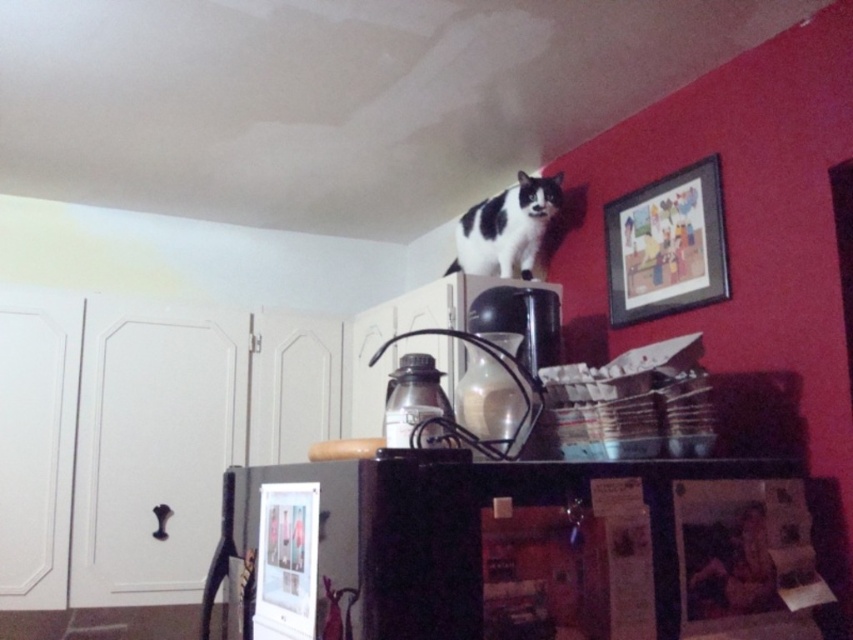
Question: Can you confirm if wooden framed artwork at upper right is thinner than black and white fur cat at upper center?

Choices:
 (A) no
 (B) yes

Answer: (B)

Question: Considering the relative positions of wooden framed artwork at upper right and black and white fur cat at upper center in the image provided, where is wooden framed artwork at upper right located with respect to black and white fur cat at upper center?

Choices:
 (A) above
 (B) below

Answer: (B)

Question: Which point appears closest to the camera in this image?

Choices:
 (A) (653, 259)
 (B) (529, 278)

Answer: (A)

Question: Can you confirm if wooden framed artwork at upper right is bigger than black and white fur cat at upper center?

Choices:
 (A) yes
 (B) no

Answer: (B)

Question: Which point appears closest to the camera in this image?

Choices:
 (A) (636, 193)
 (B) (492, 259)

Answer: (A)